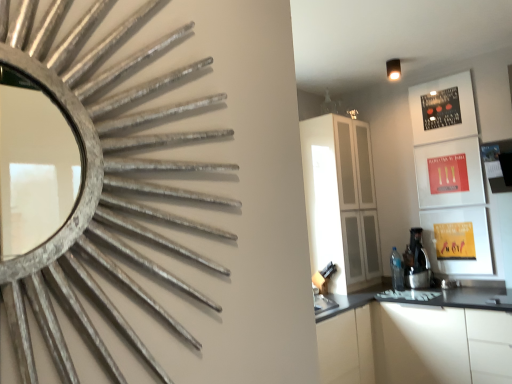
Question: Choose the correct answer: Is satin black coffee machine at right inside white glossy cabinet at center, the second cabinetry in the bottom-to-top sequence, or outside it?

Choices:
 (A) outside
 (B) inside

Answer: (A)

Question: From their relative heights in the image, would you say satin black coffee machine at right is taller or shorter than white glossy cabinet at center, which is the first cabinetry in top-to-bottom order?

Choices:
 (A) short
 (B) tall

Answer: (A)

Question: Considering the real-world distances, which object is closest to the satin black coffee machine at right?

Choices:
 (A) white glossy cabinetry at lower right, the first cabinetry positioned from the bottom
 (B) silver textured mirror at upper left
 (C) white glossy cabinet at center, which is the first cabinetry in top-to-bottom order

Answer: (C)

Question: Estimate the real-world distances between objects in this image. Which object is closer to the white glossy cabinetry at lower right, the first cabinetry positioned from the bottom?

Choices:
 (A) satin black coffee machine at right
 (B) white glossy cabinet at center, which is the first cabinetry in top-to-bottom order
 (C) silver textured mirror at upper left

Answer: (A)